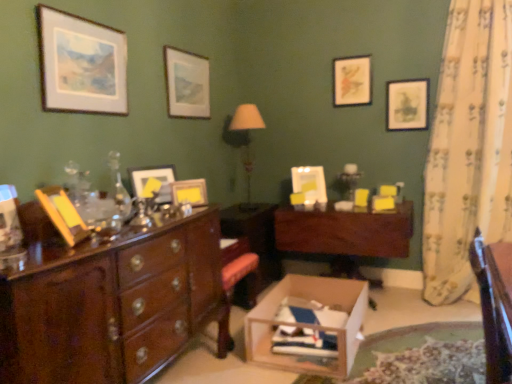
What do you see at coordinates (308, 325) in the screenshot? This screenshot has width=512, height=384. I see `wooden cardboard box at center` at bounding box center [308, 325].

This screenshot has width=512, height=384. What do you see at coordinates (352, 81) in the screenshot?
I see `matte gold picture frame at upper right, placed as the 5th picture frame when sorted from left to right` at bounding box center [352, 81].

What do you see at coordinates (189, 192) in the screenshot?
I see `matte gold picture frame at center, the second picture frame in the front-to-back sequence` at bounding box center [189, 192].

Describe the element at coordinates (113, 305) in the screenshot. I see `shiny brown wooden chest of drawers at left` at that location.

Identify the location of mahogany wood desk at center. (345, 232).

In order to click on yellow paper at center, which ranks as the fifth picture frame in right-to-left order in this screenshot , I will do `click(153, 178)`.

Locate an element on the screen. Image resolution: width=512 pixels, height=384 pixels. wooden cardboard box at center is located at coordinates (308, 325).

Is white fabric lampshade at center inside the boundaries of mahogany wood desk at center, or outside?

white fabric lampshade at center lies outside mahogany wood desk at center.

Which is in front, white fabric lampshade at center or mahogany wood desk at center?

mahogany wood desk at center.

In the scene shown: Between white fabric lampshade at center and mahogany wood desk at center, which one has larger size?

mahogany wood desk at center.

Is white fabric lampshade at center inside the boundaries of yellow paper at center, arranged as the fourth picture frame when viewed from the back, or outside?

white fabric lampshade at center is located beyond the bounds of yellow paper at center, arranged as the fourth picture frame when viewed from the back.

Who is shorter, white fabric lampshade at center or yellow paper at center, arranged as the fourth picture frame when viewed from the back?

With less height is yellow paper at center, arranged as the fourth picture frame when viewed from the back.

Considering the positions of objects white fabric lampshade at center and yellow paper at center, acting as the third picture frame starting from the front, in the image provided, who is behind, white fabric lampshade at center or yellow paper at center, acting as the third picture frame starting from the front,?

white fabric lampshade at center is behind.

Starting from the matte white picture frame at upper center, acting as the 3th picture frame starting from the left, which picture frame is the 3rd one to the right? Please provide its 2D coordinates.

[(407, 104)]

From the image's perspective, does matte white picture frame at upper center, which ranks as the fourth picture frame in right-to-left order, appear lower than matte black picture frame at upper right, placed as the second picture frame when sorted from back to front?

Incorrect, from the image's perspective, matte white picture frame at upper center, which ranks as the fourth picture frame in right-to-left order, is higher than matte black picture frame at upper right, placed as the second picture frame when sorted from back to front.

Considering the positions of objects matte white picture frame at upper center, which ranks as the fourth picture frame in right-to-left order, and matte black picture frame at upper right, arranged as the 5th picture frame when viewed from the front, in the image provided, who is more to the right, matte white picture frame at upper center, which ranks as the fourth picture frame in right-to-left order, or matte black picture frame at upper right, arranged as the 5th picture frame when viewed from the front,?

Positioned to the right is matte black picture frame at upper right, arranged as the 5th picture frame when viewed from the front.

Is point (359, 342) farther from camera compared to point (499, 179)?

No, it is not.

Can you confirm if wooden cardboard box at center is thinner than white floral fabric curtain at right?

Incorrect, the width of wooden cardboard box at center is not less than that of white floral fabric curtain at right.

Looking at this image, is wooden cardboard box at center shorter than white floral fabric curtain at right?

Correct, wooden cardboard box at center is not as tall as white floral fabric curtain at right.

Which of these two, wooden cardboard box at center or white floral fabric curtain at right, is bigger?

Bigger between the two is white floral fabric curtain at right.

From the image's perspective, does shiny brown wooden chest of drawers at left appear higher than matte gold picture frame at upper right, placed as the 6th picture frame when sorted from front to back?

No, from the image's perspective, shiny brown wooden chest of drawers at left is not above matte gold picture frame at upper right, placed as the 6th picture frame when sorted from front to back.

Is shiny brown wooden chest of drawers at left behind matte gold picture frame at upper right, placed as the 6th picture frame when sorted from front to back?

No, it is in front of matte gold picture frame at upper right, placed as the 6th picture frame when sorted from front to back.

Is the surface of shiny brown wooden chest of drawers at left in direct contact with matte gold picture frame at upper right, placed as the 5th picture frame when sorted from left to right?

No, shiny brown wooden chest of drawers at left is not in contact with matte gold picture frame at upper right, placed as the 5th picture frame when sorted from left to right.

Can you confirm if shiny brown wooden chest of drawers at left is positioned to the left of matte gold picture frame at upper right, placed as the 5th picture frame when sorted from left to right?

Yes.

Is yellow paper at center, acting as the third picture frame starting from the front, next to matte gold picture frame at upper right, the 1th picture frame in the back-to-front sequence?

yellow paper at center, acting as the third picture frame starting from the front, and matte gold picture frame at upper right, the 1th picture frame in the back-to-front sequence, are not in contact.

Is yellow paper at center, which ranks as the fifth picture frame in right-to-left order, taller or shorter than matte gold picture frame at upper right, the 1th picture frame in the back-to-front sequence?

yellow paper at center, which ranks as the fifth picture frame in right-to-left order, is shorter than matte gold picture frame at upper right, the 1th picture frame in the back-to-front sequence.

Does yellow paper at center, the second picture frame from the left, contain matte gold picture frame at upper right, placed as the 5th picture frame when sorted from left to right?

No.

How different are the orientations of yellow paper at center, arranged as the fourth picture frame when viewed from the back, and matte gold picture frame at upper right, placed as the 5th picture frame when sorted from left to right, in degrees?

The angular difference between yellow paper at center, arranged as the fourth picture frame when viewed from the back, and matte gold picture frame at upper right, placed as the 5th picture frame when sorted from left to right, is 63.8 degrees.

From a real-world perspective, is mahogany wood desk at center physically below matte black picture frame at upper right, positioned as the 6th picture frame in left-to-right order?

Correct, in the physical world, mahogany wood desk at center is lower than matte black picture frame at upper right, positioned as the 6th picture frame in left-to-right order.

Identify the location of cabinetry located in front of the matte black picture frame at upper right, arranged as the 5th picture frame when viewed from the front. The image size is (512, 384). (255, 234).

In the scene shown: Who is taller, mahogany wood desk at center or matte black picture frame at upper right, arranged as the 5th picture frame when viewed from the front?

mahogany wood desk at center is taller.

Find the location of a particular element. This screenshot has height=384, width=512. table lamp above the mahogany wood desk at center (from a real-world perspective) is located at coordinates (246, 142).

Identify the location of the 3rd picture frame in front of the white fabric lampshade at center, starting your count from the anchor. (153, 178).

Based on their spatial positions, is matte black picture frame at upper right, placed as the second picture frame when sorted from back to front, or white floral fabric curtain at right closer to matte gold picture frame at center, the second picture frame in the front-to-back sequence?

The object closer to matte gold picture frame at center, the second picture frame in the front-to-back sequence, is matte black picture frame at upper right, placed as the second picture frame when sorted from back to front.

Based on their spatial positions, is shiny brown wooden chest of drawers at left or matte gold picture frame at upper right, placed as the 6th picture frame when sorted from front to back, further from wooden cardboard box at center?

Among the two, matte gold picture frame at upper right, placed as the 6th picture frame when sorted from front to back, is located further to wooden cardboard box at center.

From the image, which object appears to be farther from mahogany wood desk at center, wooden cardboard box at center or matte gold picture frame at center, which ranks as the 3th picture frame in right-to-left order?

matte gold picture frame at center, which ranks as the 3th picture frame in right-to-left order.

Based on the photo, based on their spatial positions, is matte gold picture frame at center, which ranks as the 3th picture frame in right-to-left order, or shiny brown wooden chest of drawers at left further from wooden cardboard box at center?

matte gold picture frame at center, which ranks as the 3th picture frame in right-to-left order, lies further to wooden cardboard box at center than the other object.

Looking at this image, looking at the image, which one is located further to wooden cardboard box at center, matte white picture frame at upper left, acting as the 6th picture frame starting from the right, or white fabric lampshade at center?

matte white picture frame at upper left, acting as the 6th picture frame starting from the right, is positioned further to the anchor wooden cardboard box at center.

From the image, which object appears to be nearer to wooden cardboard box at center, shiny brown wooden chest of drawers at left or matte gold picture frame at center, the second picture frame in the front-to-back sequence?

Based on the image, shiny brown wooden chest of drawers at left appears to be nearer to wooden cardboard box at center.

Looking at the image, which one is located further to matte white picture frame at upper center, the 4th picture frame viewed from the front, yellow paper at center, which ranks as the fifth picture frame in right-to-left order, or white floral fabric curtain at right?

white floral fabric curtain at right.

Looking at the image, which one is located further to mahogany wood desk at center, white floral fabric curtain at right or shiny brown wooden chest of drawers at left?

white floral fabric curtain at right lies further to mahogany wood desk at center than the other object.

Where is `cardboard box situated between yellow paper at center, acting as the third picture frame starting from the front, and white floral fabric curtain at right from left to right`? This screenshot has width=512, height=384. cardboard box situated between yellow paper at center, acting as the third picture frame starting from the front, and white floral fabric curtain at right from left to right is located at coordinates (308, 325).

This screenshot has width=512, height=384. What are the coordinates of `table lamp situated between matte gold picture frame at center, which is the fourth picture frame in left-to-right order, and white floral fabric curtain at right from left to right` in the screenshot? It's located at (246, 142).

The width and height of the screenshot is (512, 384). What are the coordinates of `curtain between matte black picture frame at upper right, which is the first picture frame from right to left, and wooden cardboard box at center, in the vertical direction` in the screenshot? It's located at (468, 146).

The height and width of the screenshot is (384, 512). Find the location of `the chest of drawers situated between matte white picture frame at upper left, which is counted as the 6th picture frame, starting from the back, and white floral fabric curtain at right from left to right`. the chest of drawers situated between matte white picture frame at upper left, which is counted as the 6th picture frame, starting from the back, and white floral fabric curtain at right from left to right is located at coordinates (113, 305).